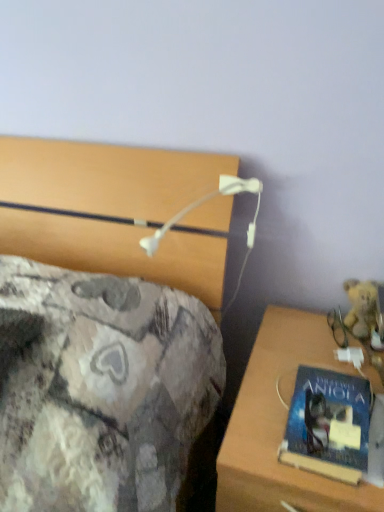
Locate an element on the screen. The height and width of the screenshot is (512, 384). empty space that is ontop of wooden desk at lower right (from a real-world perspective) is located at coordinates (319, 367).